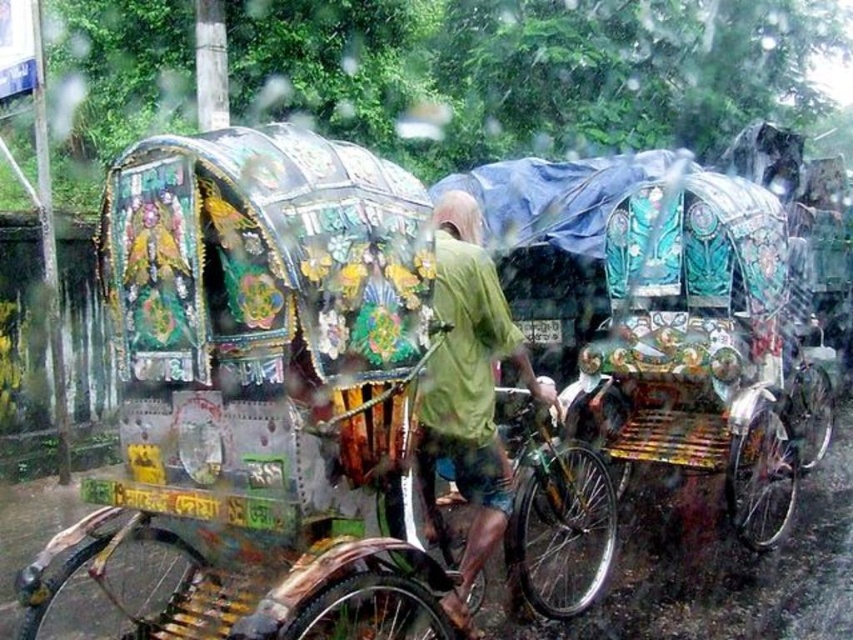
From the picture: Which of these two, shiny metallic bicycle at center or metallic silver bicycle at center, stands taller?

metallic silver bicycle at center

Locate an element on the screen. The image size is (853, 640). shiny metallic bicycle at center is located at coordinates (555, 515).

Does point (573, 465) lie behind point (799, 440)?

That is False.

Where is `shiny metallic bicycle at center`? The image size is (853, 640). shiny metallic bicycle at center is located at coordinates (555, 515).

From the picture: Between decorative painted rickshaw at left and shiny metallic bicycle at center, which one is positioned higher?

Positioned higher is decorative painted rickshaw at left.

Does point (167, 605) lie in front of point (550, 436)?

Yes, point (167, 605) is in front of point (550, 436).

At what (x,y) coordinates should I click in order to perform the action: click on decorative painted rickshaw at left. Please return your answer as a coordinate pair (x, y). This screenshot has height=640, width=853. Looking at the image, I should click on (280, 396).

Between point (160, 310) and point (796, 442), which one is positioned in front?

Positioned in front is point (160, 310).

Is decorative painted rickshaw at left in front of metallic silver bicycle at center?

Yes, decorative painted rickshaw at left is in front of metallic silver bicycle at center.

Does point (491, 371) come behind point (817, 404)?

That is False.

Identify the location of decorative painted rickshaw at left. (280, 396).